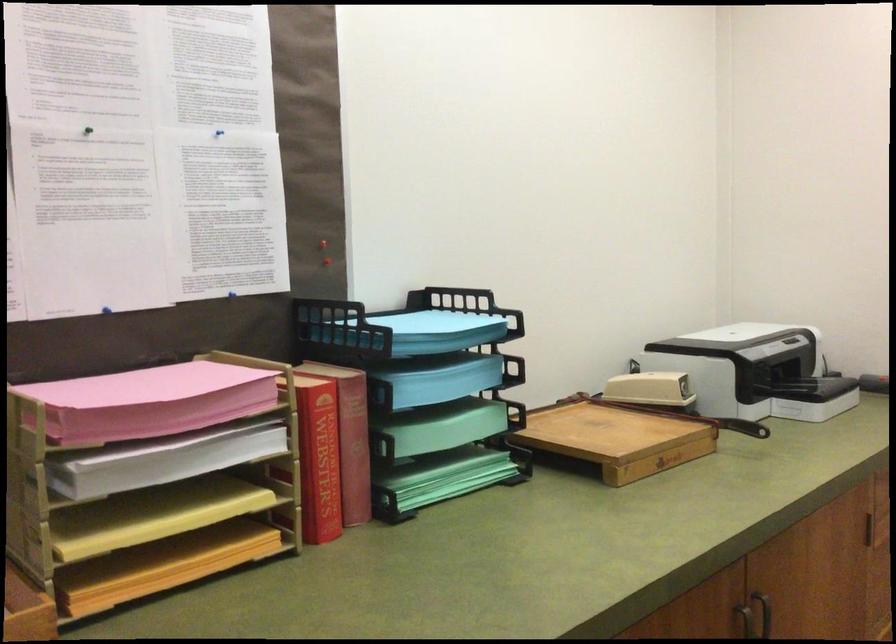
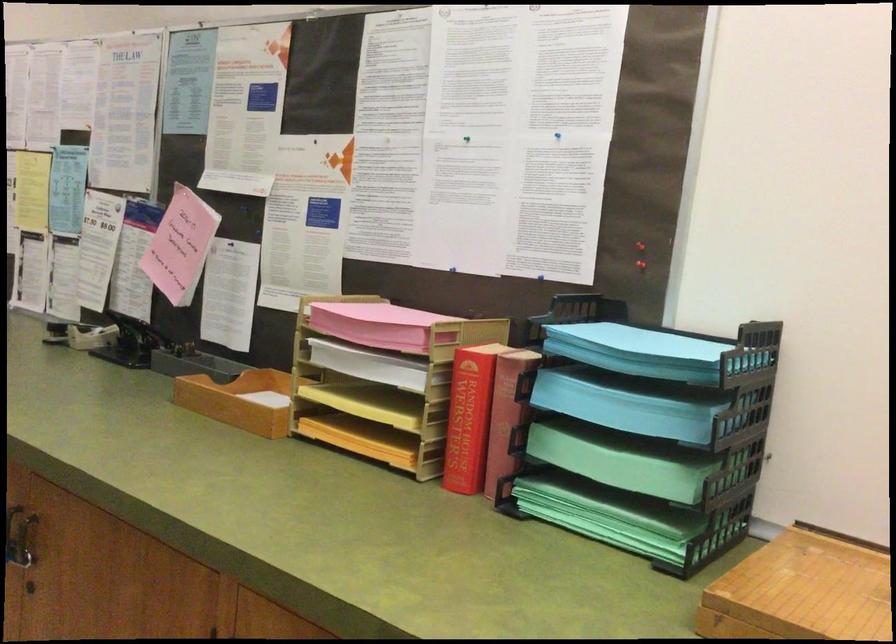
The point at [316,247] is marked in the first image. Where is the corresponding point in the second image?

(640, 245)